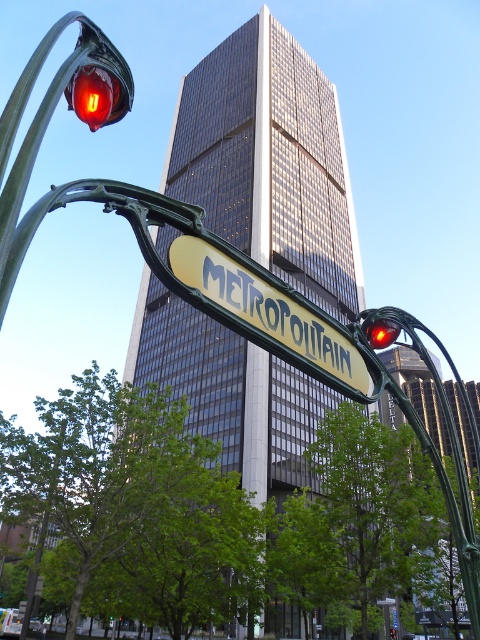
Question: Does yellow-green metal sign at center appear on the left side of matte red traffic light at upper left?

Choices:
 (A) no
 (B) yes

Answer: (A)

Question: Which object appears closest to the camera in this image?

Choices:
 (A) yellow-green metal sign at center
 (B) glossy plastic traffic light at center

Answer: (A)

Question: Which point is farther to the camera?

Choices:
 (A) matte red traffic light at upper left
 (B) yellow-green metal sign at center

Answer: (A)

Question: In this image, where is matte red traffic light at upper left located relative to glossy plastic traffic light at center?

Choices:
 (A) above
 (B) below

Answer: (A)

Question: Does yellow-green metal sign at center appear over glossy plastic traffic light at center?

Choices:
 (A) no
 (B) yes

Answer: (A)

Question: Which object appears farthest from the camera in this image?

Choices:
 (A) matte red traffic light at upper left
 (B) glossy plastic traffic light at center

Answer: (B)